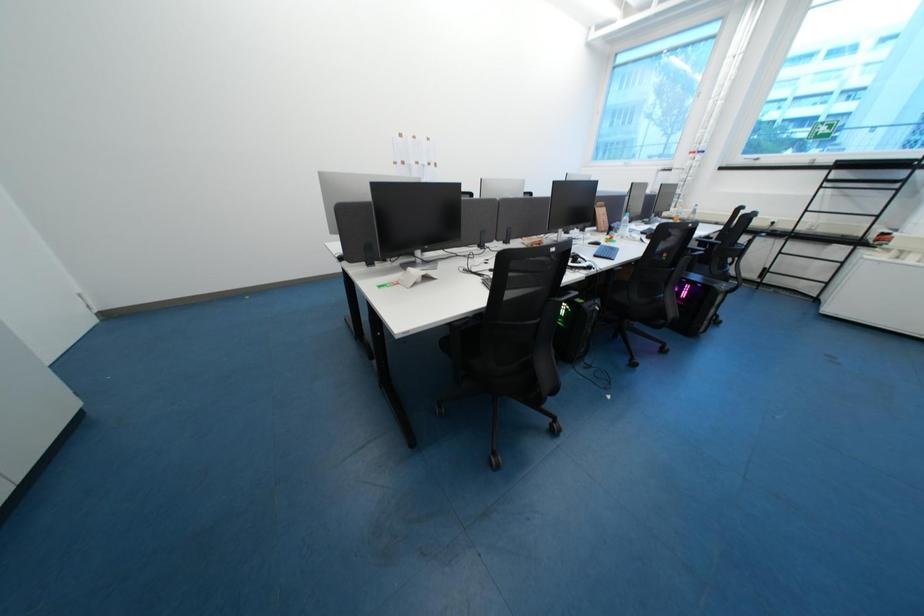
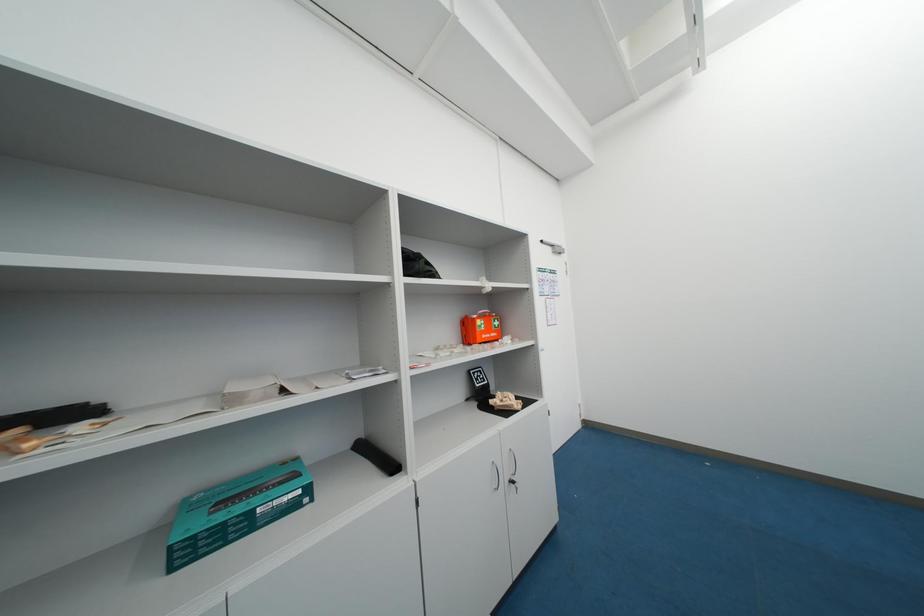
Question: How did the camera likely rotate?

Choices:
 (A) Left
 (B) Right
 (C) Up
 (D) Down

Answer: (A)